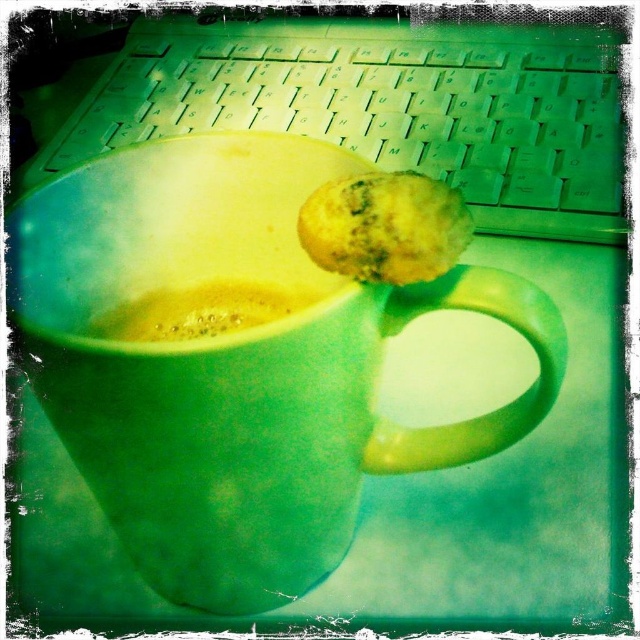
Can you confirm if green plastic keyboard at upper center is wider than yellowish matte muffin at center?

Yes.

Locate an element on the screen. This screenshot has height=640, width=640. green plastic keyboard at upper center is located at coordinates (385, 106).

In the scene shown: Is green matte mug at center smaller than green plastic keyboard at upper center?

Yes, green matte mug at center is smaller than green plastic keyboard at upper center.

Who is more forward, (282, 275) or (472, 184)?

Point (282, 275) is in front.

Between point (321, 324) and point (403, 92), which one is positioned in front?

Point (321, 324)

The width and height of the screenshot is (640, 640). I want to click on green matte mug at center, so point(234,364).

Which is below, yellowish matte muffin at center or yellow frothy liquid at center?

Positioned lower is yellow frothy liquid at center.

Does yellowish matte muffin at center appear over yellow frothy liquid at center?

Yes, yellowish matte muffin at center is above yellow frothy liquid at center.

Is point (381, 260) closer to camera compared to point (220, 296)?

Yes.

What are the coordinates of `yellowish matte muffin at center` in the screenshot? It's located at (385, 227).